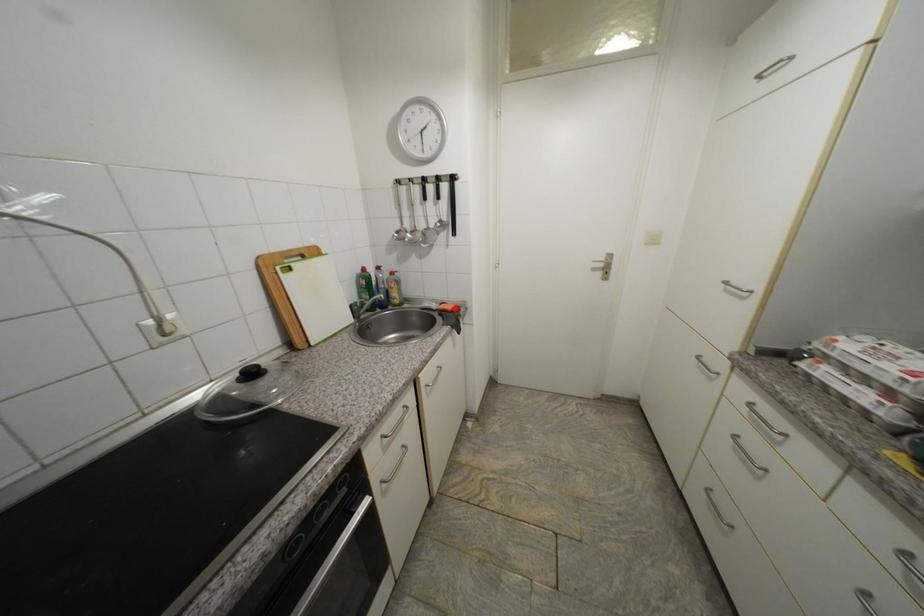
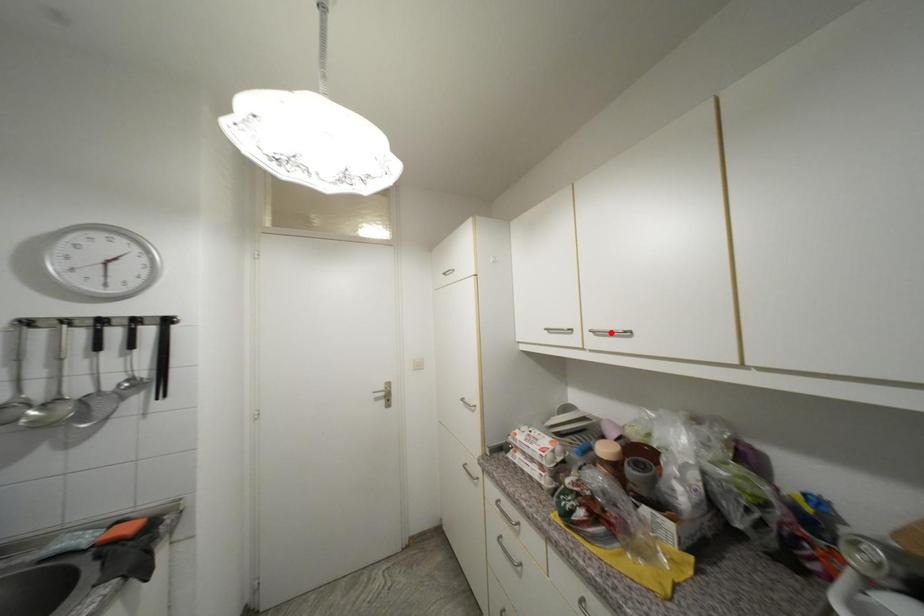
I am providing you with two images of the same scene from different viewpoints. A red point is marked on the first image and another point is marked on the second image. Is the marked point in image1 the same physical position as the marked point in image2?

No